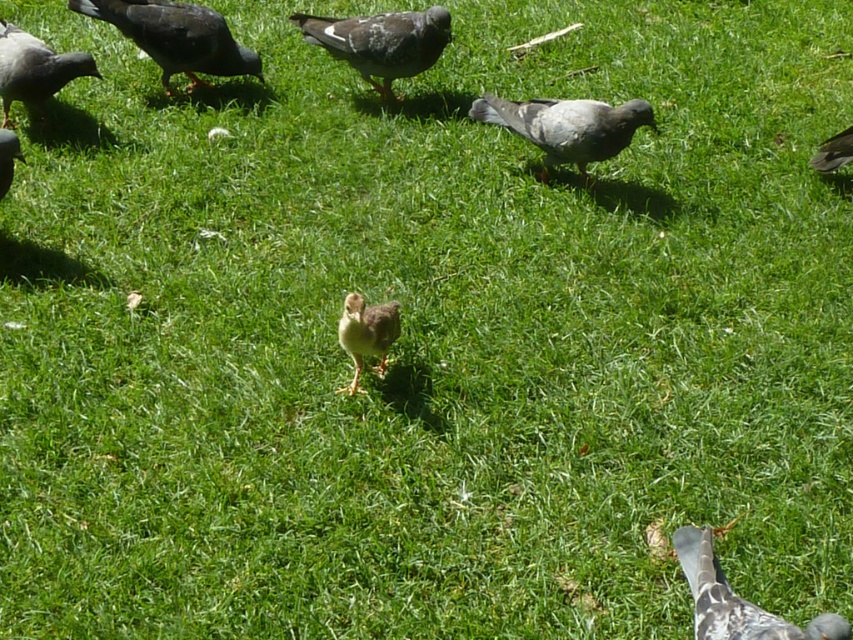
Question: Can you confirm if gray matte pigeon at upper right is wider than speckled feather pigeon at lower right?

Choices:
 (A) yes
 (B) no

Answer: (A)

Question: Does brown downy chick at center appear over brown feathered pigeon at upper right?

Choices:
 (A) yes
 (B) no

Answer: (B)

Question: Among these objects, which one is farthest from the camera?

Choices:
 (A) gray matte pigeon at upper left
 (B) speckled feathered pigeon at center
 (C) brown feathered pigeon at upper right
 (D) matte gray pigeon at lower left

Answer: (A)

Question: Which point appears closest to the camera in this image?

Choices:
 (A) (848, 131)
 (B) (389, 17)
 (C) (367, 328)

Answer: (C)

Question: From the image, what is the correct spatial relationship of gray matte pigeon at upper right in relation to matte gray pigeon at lower left?

Choices:
 (A) above
 (B) below

Answer: (A)

Question: Which point appears closest to the camera in this image?

Choices:
 (A) (4, 115)
 (B) (840, 166)
 (C) (782, 634)
 (D) (357, 369)

Answer: (C)